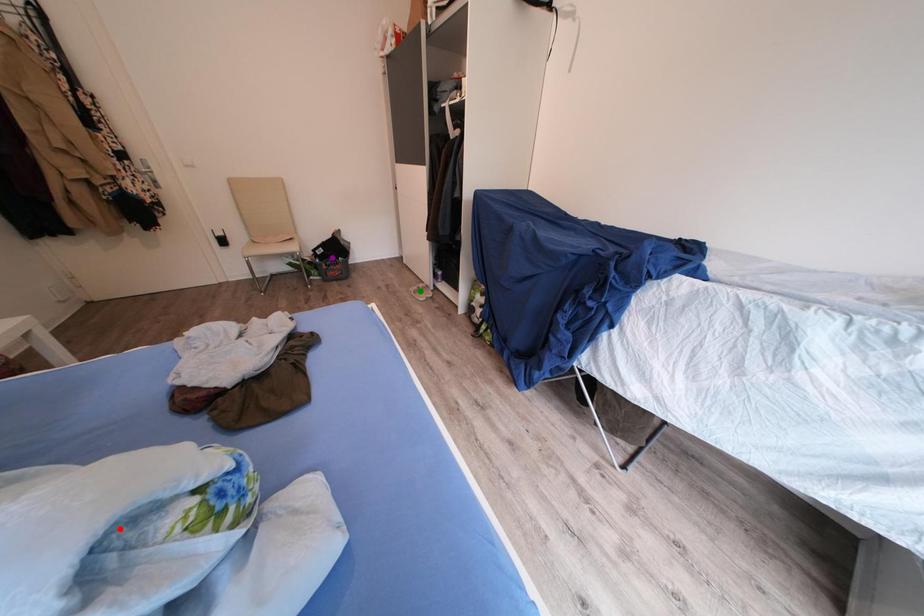
Order these from nearest to farthest:
purple point | green point | red point

red point < green point < purple point